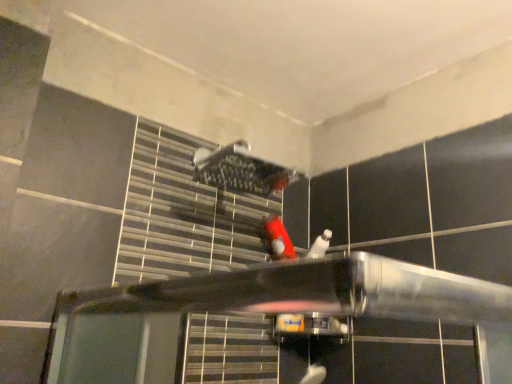
Question: Is red matte plush toy at center wider or thinner than brushed metal shower at upper center?

Choices:
 (A) wide
 (B) thin

Answer: (A)

Question: Is red matte plush toy at center spatially inside brushed metal shower at upper center, or outside of it?

Choices:
 (A) inside
 (B) outside

Answer: (B)

Question: Considering the positions of red matte plush toy at center and brushed metal shower at upper center in the image, is red matte plush toy at center taller or shorter than brushed metal shower at upper center?

Choices:
 (A) short
 (B) tall

Answer: (A)

Question: Would you say brushed metal shower at upper center is to the left or to the right of red matte plush toy at center in the picture?

Choices:
 (A) right
 (B) left

Answer: (B)

Question: Is brushed metal shower at upper center wider or thinner than red matte plush toy at center?

Choices:
 (A) wide
 (B) thin

Answer: (B)

Question: Considering the positions of brushed metal shower at upper center and red matte plush toy at center in the image, is brushed metal shower at upper center bigger or smaller than red matte plush toy at center?

Choices:
 (A) small
 (B) big

Answer: (B)

Question: Considering their positions, is brushed metal shower at upper center located in front of or behind red matte plush toy at center?

Choices:
 (A) behind
 (B) front

Answer: (B)